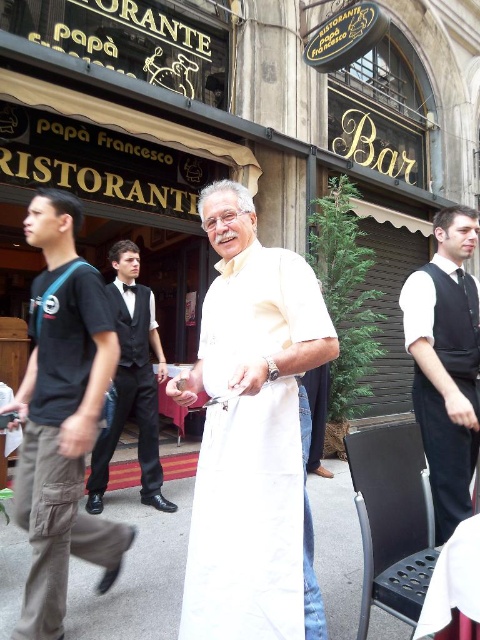
Question: Which point is closer to the camera?

Choices:
 (A) white fabric apron at center
 (B) black satin vest at right
 (C) black cotton t-shirt at left
 (D) black satin vest at center

Answer: (A)

Question: Can you confirm if black cotton t-shirt at left is positioned to the left of black satin vest at center?

Choices:
 (A) yes
 (B) no

Answer: (B)

Question: Considering the real-world distances, which object is closest to the black satin vest at center?

Choices:
 (A) white fabric apron at center
 (B) black satin vest at right

Answer: (A)

Question: Which of the following is the farthest from the observer?

Choices:
 (A) black cotton t-shirt at left
 (B) black satin vest at center

Answer: (B)

Question: Does black satin vest at right appear on the left side of black satin vest at center?

Choices:
 (A) no
 (B) yes

Answer: (A)

Question: Is black cotton t-shirt at left to the right of black satin vest at right from the viewer's perspective?

Choices:
 (A) yes
 (B) no

Answer: (B)